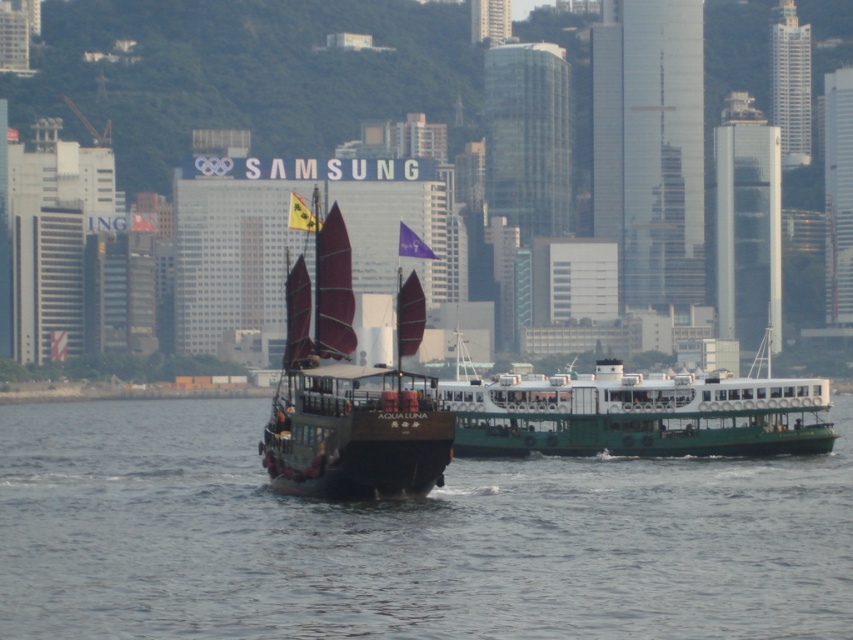
Is dark brown wooden sailboat at center to the left of green matte ferry at center from the viewer's perspective?

Correct, you'll find dark brown wooden sailboat at center to the left of green matte ferry at center.

Does dark brown wooden sailboat at center lie in front of green matte ferry at center?

Yes.

Between point (350, 317) and point (654, 429), which one is positioned behind?

Positioned behind is point (654, 429).

The image size is (853, 640). Find the location of `dark brown wooden sailboat at center`. dark brown wooden sailboat at center is located at coordinates (350, 392).

Describe the element at coordinates (405, 538) in the screenshot. The image size is (853, 640). I see `smooth water at center` at that location.

In the scene shown: Is smooth water at center thinner than dark brown wooden sailboat at center?

No, smooth water at center is not thinner than dark brown wooden sailboat at center.

What do you see at coordinates (405, 538) in the screenshot?
I see `smooth water at center` at bounding box center [405, 538].

I want to click on smooth water at center, so (405, 538).

Between point (675, 580) and point (726, 428), which one is positioned behind?

Point (726, 428)

Can you confirm if smooth water at center is wider than green matte ferry at center?

Yes, smooth water at center is wider than green matte ferry at center.

Where is `smooth water at center`? The height and width of the screenshot is (640, 853). smooth water at center is located at coordinates (405, 538).